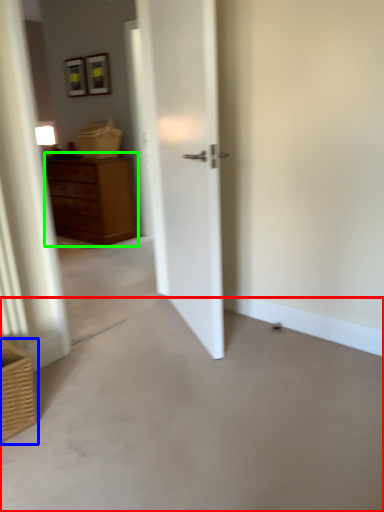
Question: Which object is the farthest from concrete (highlighted by a red box)? Choose among these: basket (highlighted by a blue box) or chest of drawers (highlighted by a green box).

Choices:
 (A) basket
 (B) chest of drawers

Answer: (B)